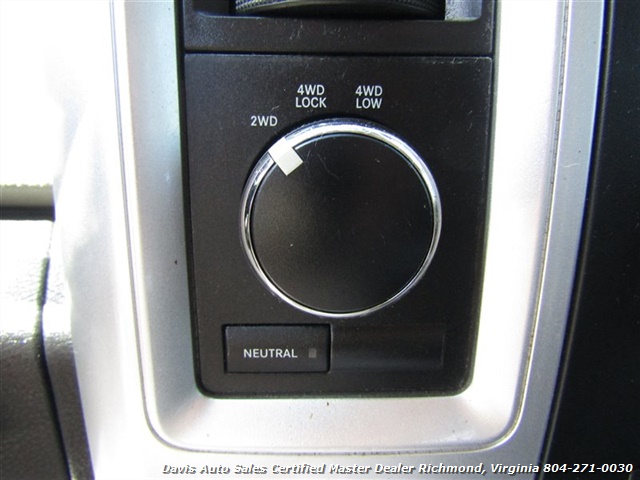
Where is `circular dial knob`? The width and height of the screenshot is (640, 480). circular dial knob is located at coordinates (266, 8).